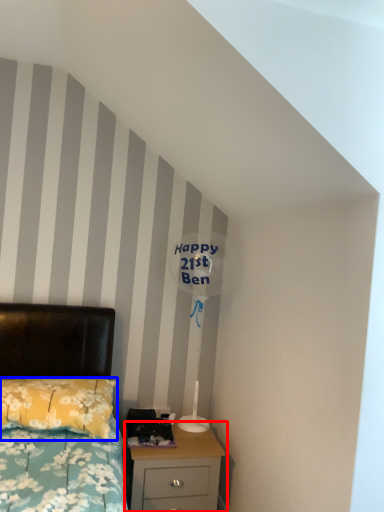
Question: Which object is further to the camera taking this photo, nightstand (highlighted by a red box) or pillow (highlighted by a blue box)?

Choices:
 (A) nightstand
 (B) pillow

Answer: (A)